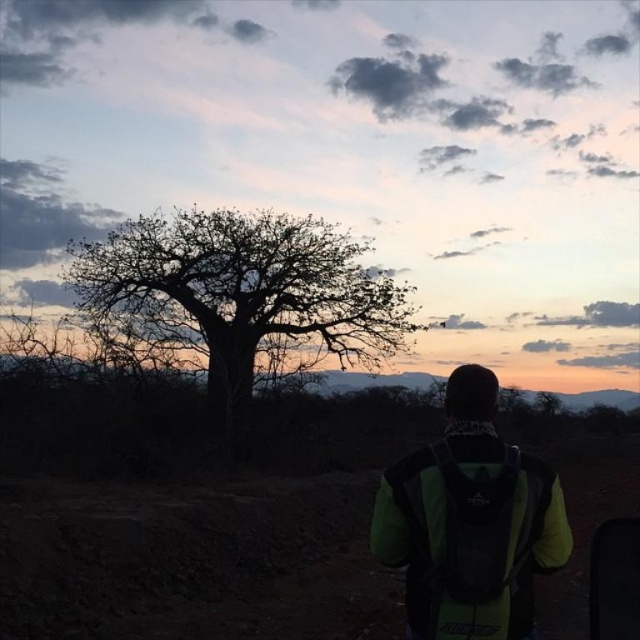
Question: Is silhouette wood tree at center closer to camera compared to green fabric backpack at center?

Choices:
 (A) yes
 (B) no

Answer: (B)

Question: Does silhouette wood tree at center have a lesser width compared to green fabric backpack at center?

Choices:
 (A) no
 (B) yes

Answer: (A)

Question: Among these objects, which one is nearest to the camera?

Choices:
 (A) green fabric backpack at center
 (B) silhouette wood tree at center

Answer: (A)

Question: Does silhouette wood tree at center appear on the left side of green fabric backpack at center?

Choices:
 (A) yes
 (B) no

Answer: (A)

Question: Which point is closer to the camera?

Choices:
 (A) (470, 481)
 (B) (296, 308)

Answer: (A)